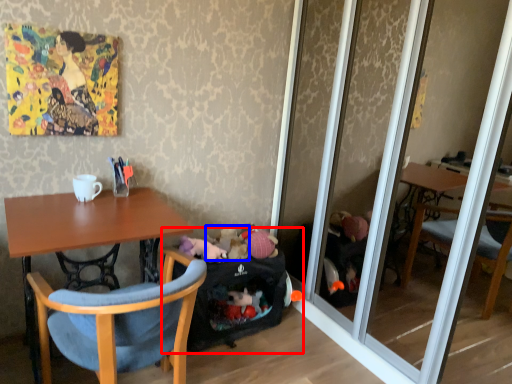
Question: Among these objects, which one is nearest to the camera, baby carriage (highlighted by a red box) or toy (highlighted by a blue box)?

Choices:
 (A) baby carriage
 (B) toy

Answer: (A)